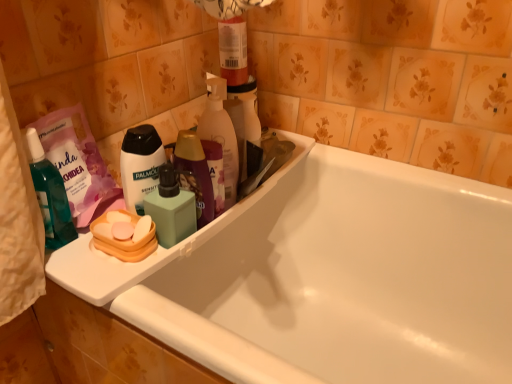
This screenshot has width=512, height=384. Find the location of `vacant area that is in front of green matte soap dispenser at center, the first toiletry in the right-to-left sequence`. vacant area that is in front of green matte soap dispenser at center, the first toiletry in the right-to-left sequence is located at coordinates (146, 287).